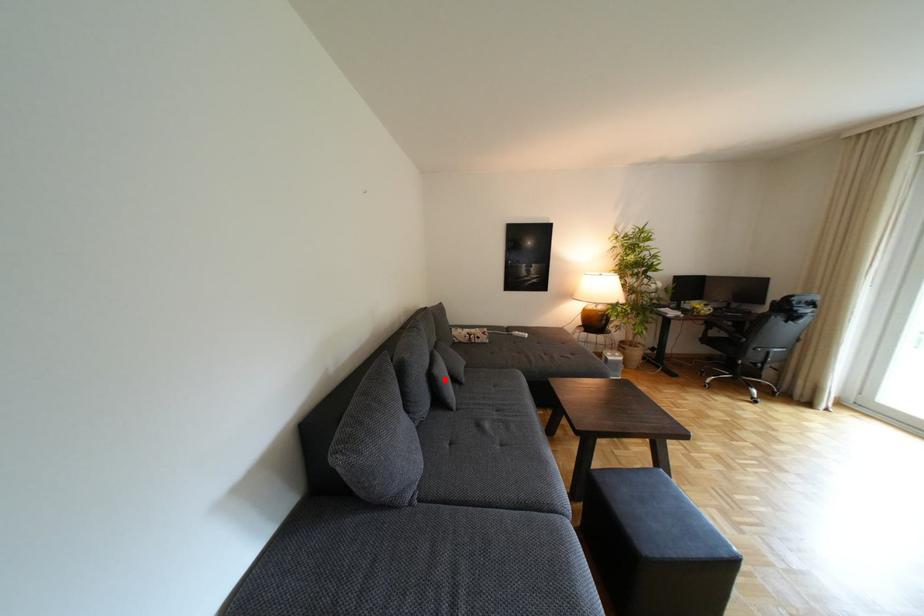
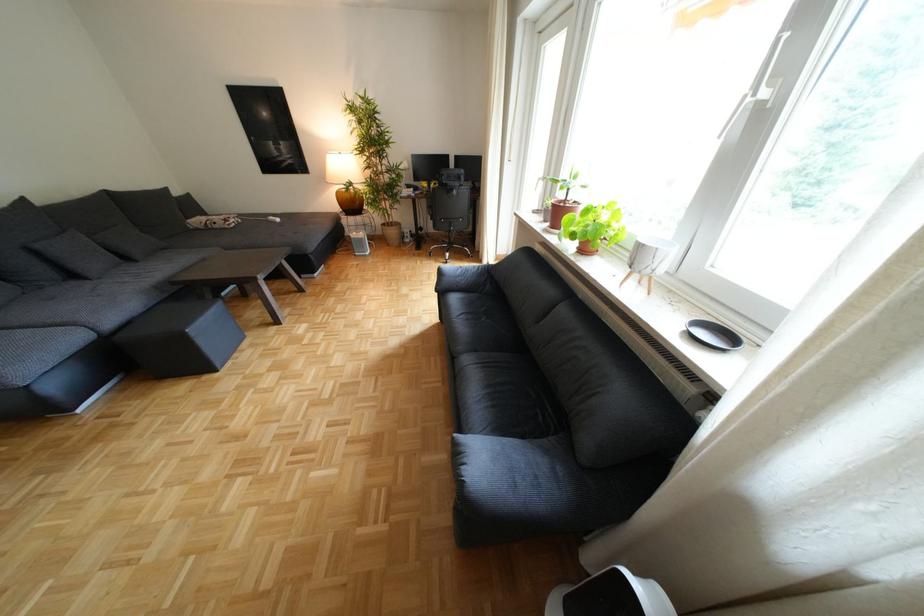
Question: I am providing you with two images of the same scene from different viewpoints. In image1, a red point is highlighted. Considering the same 3D point in image2, which of the following is correct?

Choices:
 (A) It is closer
 (B) It is farther

Answer: (B)